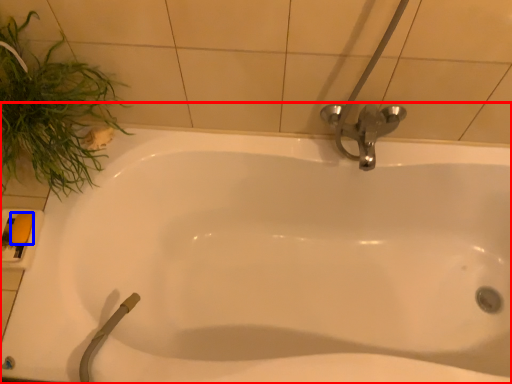
Question: Which object is closer to the camera taking this photo, bathtub (highlighted by a red box) or soap (highlighted by a blue box)?

Choices:
 (A) bathtub
 (B) soap

Answer: (A)